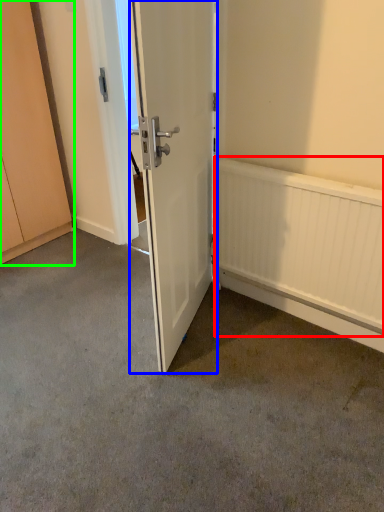
Question: Which is nearer to the radiator (highlighted by a red box)? door (highlighted by a blue box) or cabinetry (highlighted by a green box).

Choices:
 (A) door
 (B) cabinetry

Answer: (A)